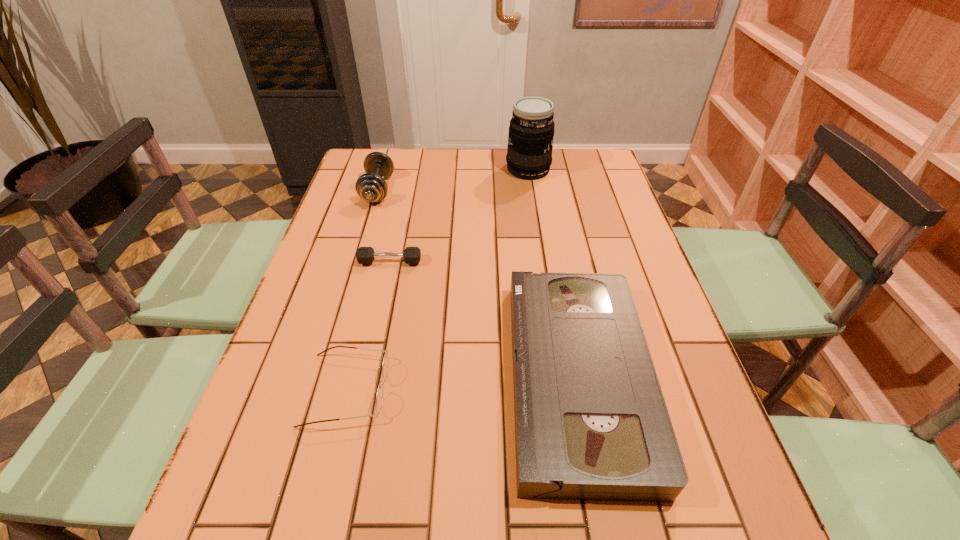
The width and height of the screenshot is (960, 540). In order to click on free location at the far right corner in this screenshot , I will do `click(571, 158)`.

The image size is (960, 540). I want to click on empty location between the fourth shortest object and the spectacles, so pos(362,289).

Locate an element on the screen. Image resolution: width=960 pixels, height=540 pixels. vacant area that lies between the nearer dumbbell and the telephoto lens is located at coordinates (459, 215).

You are a GUI agent. You are given a task and a screenshot of the screen. Output one action in this format:
    pyautogui.click(x=<x>, y=<y>)
    Task: Click on the free space between the spectacles and the third shortest object
    
    Given the screenshot: What is the action you would take?
    pyautogui.click(x=463, y=383)

Where is `vacant area that lies between the taller dumbbell and the telephoto lens`? The height and width of the screenshot is (540, 960). vacant area that lies between the taller dumbbell and the telephoto lens is located at coordinates (453, 180).

At what (x,y) coordinates should I click in order to perform the action: click on vacant area that lies between the videotape and the taller dumbbell. Please return your answer as a coordinate pair (x, y). The width and height of the screenshot is (960, 540). Looking at the image, I should click on (478, 284).

Find the location of `vacant area that lies between the videotape and the tallest object`. vacant area that lies between the videotape and the tallest object is located at coordinates (553, 273).

Image resolution: width=960 pixels, height=540 pixels. I want to click on free space between the nearer dumbbell and the spectacles, so click(x=369, y=326).

What are the coordinates of `free space between the tallest object and the third farthest object` in the screenshot? It's located at (459, 215).

I want to click on empty space that is in between the spectacles and the tallest object, so click(x=438, y=279).